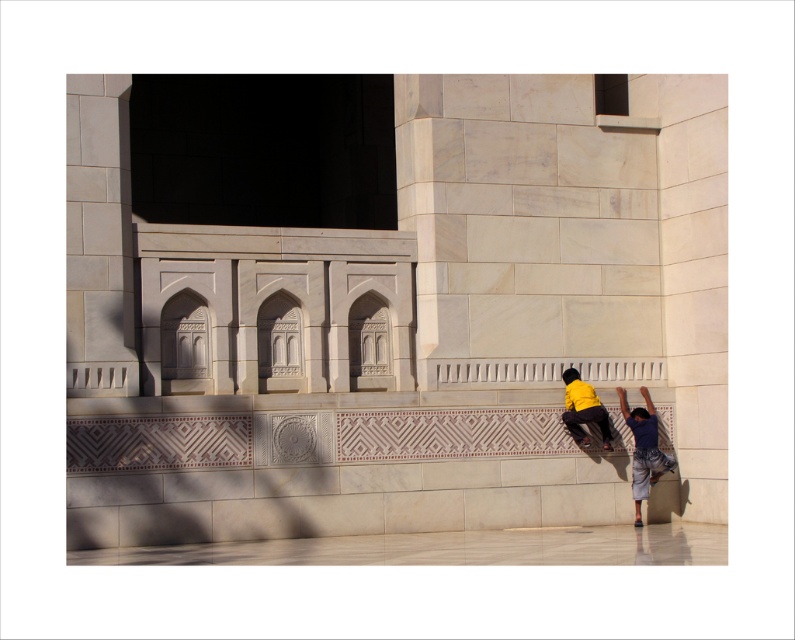
Can you confirm if yellow matte skateboard at lower center is positioned to the right of black rubber skateboard at lower center?

No, yellow matte skateboard at lower center is not to the right of black rubber skateboard at lower center.

Does yellow matte skateboard at lower center appear under black rubber skateboard at lower center?

No.

Find the location of `yellow matte skateboard at lower center`. yellow matte skateboard at lower center is located at coordinates (584, 410).

Can you confirm if blue denim pants at lower right is shorter than black rubber skateboard at lower center?

Incorrect, blue denim pants at lower right's height does not fall short of black rubber skateboard at lower center's.

Is blue denim pants at lower right positioned at the back of black rubber skateboard at lower center?

Yes, it is behind black rubber skateboard at lower center.

I want to click on blue denim pants at lower right, so click(x=642, y=449).

In order to click on blue denim pants at lower right in this screenshot , I will do `click(642, 449)`.

Which is above, blue denim pants at lower right or yellow matte skateboard at lower center?

yellow matte skateboard at lower center

Is blue denim pants at lower right in front of yellow matte skateboard at lower center?

No, blue denim pants at lower right is behind yellow matte skateboard at lower center.

Between point (658, 456) and point (574, 369), which one is positioned behind?

The point (574, 369) is behind.

This screenshot has height=640, width=795. Find the location of `blue denim pants at lower right`. blue denim pants at lower right is located at coordinates (642, 449).